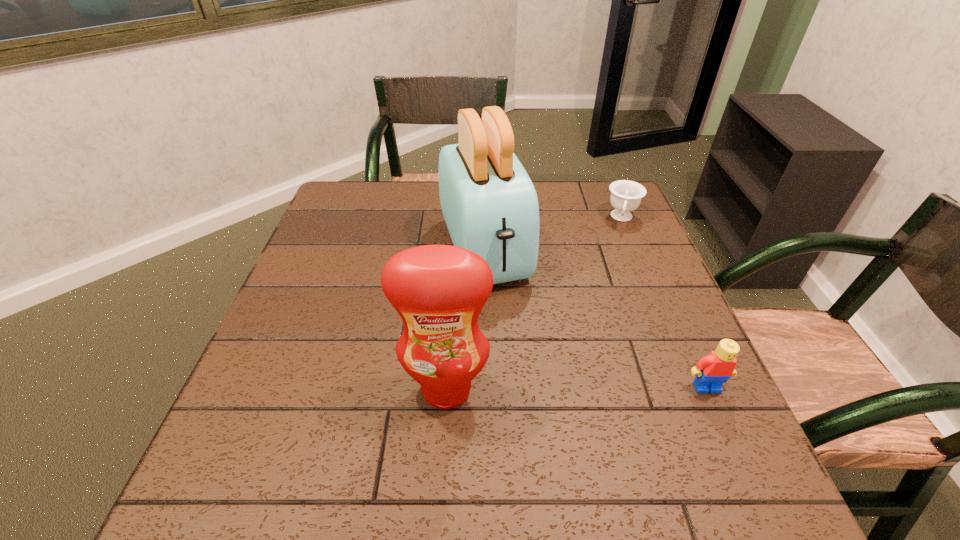
Find the location of a particular element. The height and width of the screenshot is (540, 960). vacant space on the desktop that is between the condiment and the third tallest object and is positioned on the side of the shortest object with the handle is located at coordinates (594, 388).

Where is `vacant space on the desktop that is between the condiment and the Lego and is positioned on the side of the toaster with the lever`? This screenshot has width=960, height=540. vacant space on the desktop that is between the condiment and the Lego and is positioned on the side of the toaster with the lever is located at coordinates (544, 388).